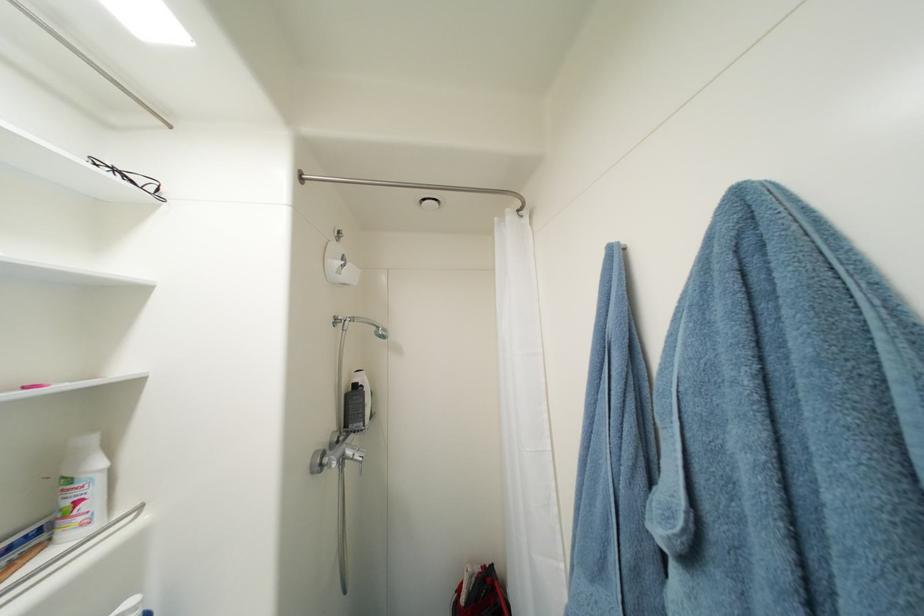
At what (x,y) coordinates should I click in order to perform the action: click on metal towel hook. Please return your answer as a coordinate pair (x, y). The height and width of the screenshot is (616, 924). Looking at the image, I should click on (415, 187).